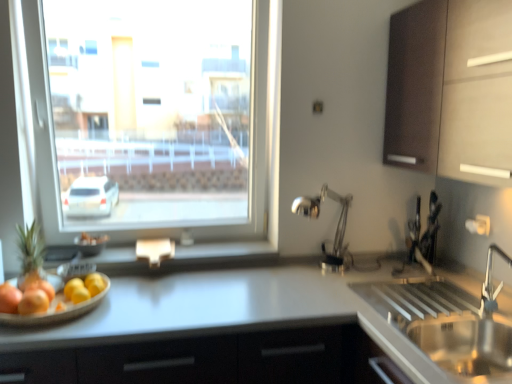
I want to click on free spot to the right of smooth wooden tray at lower left, which is the 1th fruit from left to right, so click(148, 304).